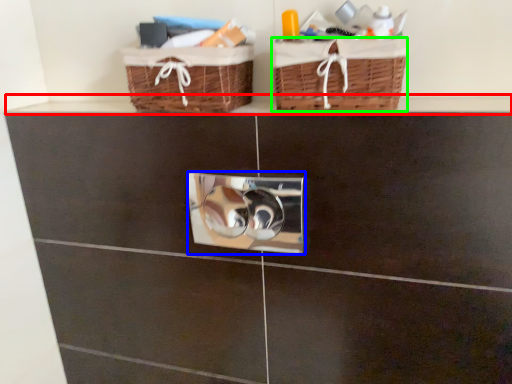
Question: Considering the real-world distances, which object is farthest from ledge (highlighted by a red box)? lock (highlighted by a blue box) or basket (highlighted by a green box)?

Choices:
 (A) lock
 (B) basket

Answer: (B)